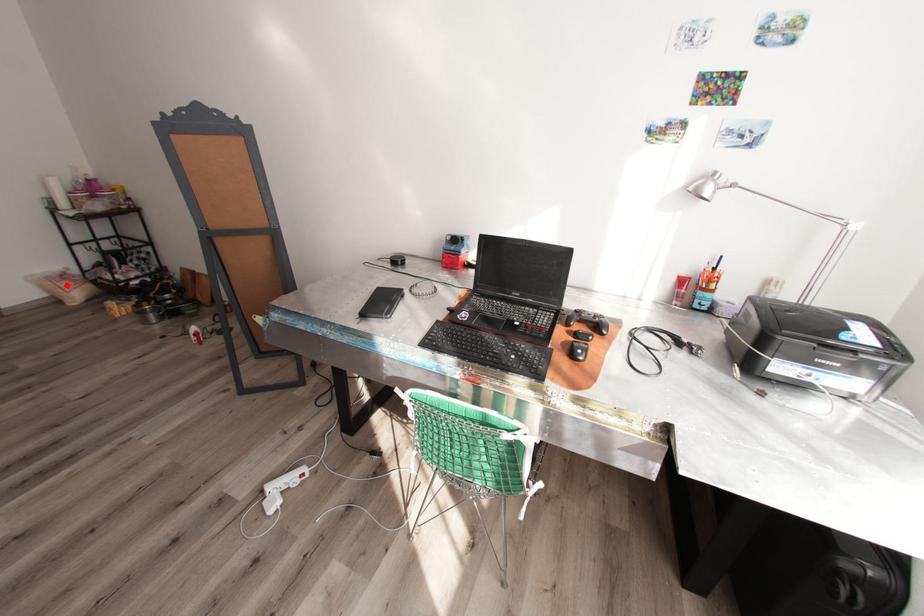
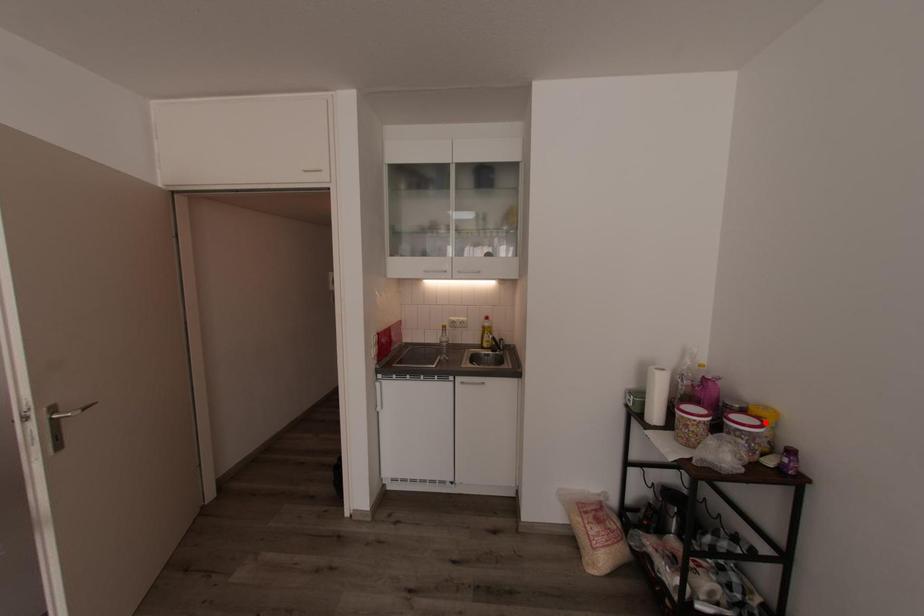
I am providing you with two images of the same scene from different viewpoints. A red point is marked on the first image and another point is marked on the second image. Are the points marked in image1 and image2 representing the same 3D position?

No